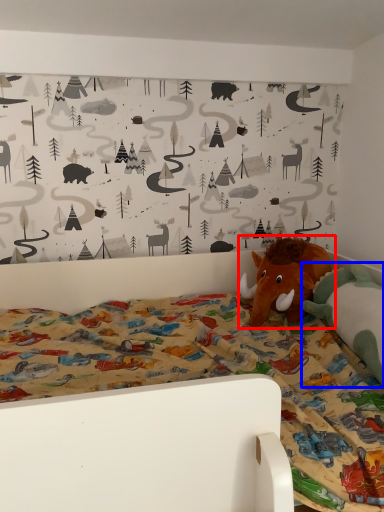
Question: Which object is further to the camera taking this photo, toy (highlighted by a red box) or toy (highlighted by a blue box)?

Choices:
 (A) toy
 (B) toy

Answer: (A)